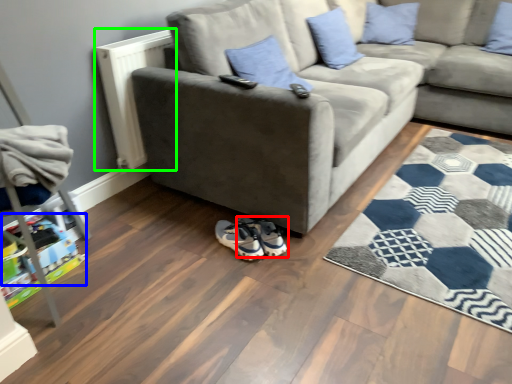
Question: Which object is positioned closest to footwear (highlighted by a red box)? Select from toy (highlighted by a blue box) and radiator (highlighted by a green box).

Choices:
 (A) toy
 (B) radiator

Answer: (A)